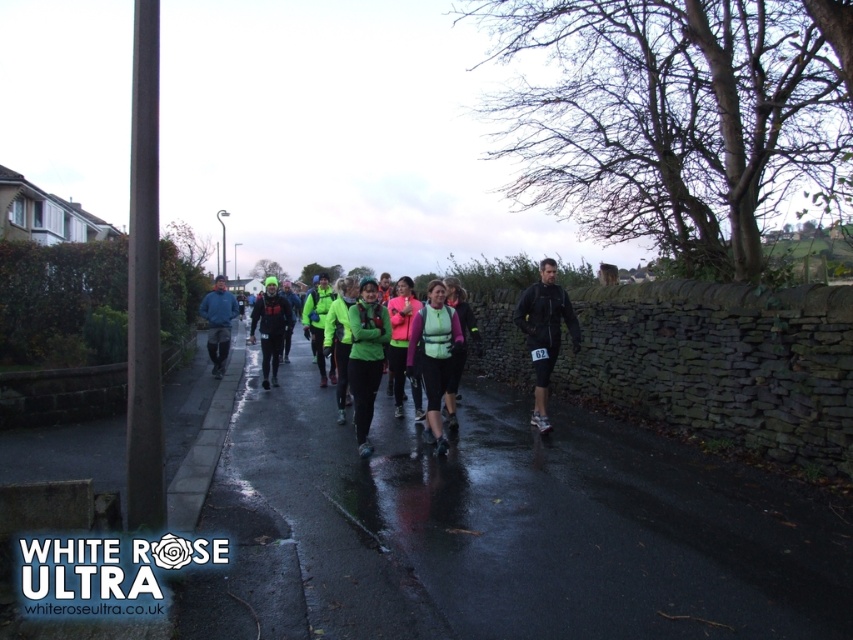
Looking at this image, you are a race official at the White Rose Ultra. You need to determine if the green matte vest at center and the black matte running suit at center are close enough to be considered in the same group for the race standings. The rule states that runners must be within 5 meters of each other to qualify. Can you confirm if they meet this requirement?

The distance between the green matte vest at center and the black matte running suit at center is 5.82 meters, which exceeds the 5 meters requirement. Therefore, they do not qualify as being in the same group.

From the picture: You are a photographer wanting to capture both the green matte jacket at center and the matte blue jacket at center in a single frame. Since the road is wet and reflective, you need to ensure that the jackets are positioned such that their widths do not overlap in the reflection. Given their sizes, which jacket should you place closer to the camera to avoid overlapping reflections?

The green matte jacket at center has a smaller width than the matte blue jacket at center. To prevent overlapping reflections, position the narrower green matte jacket at center closer to the camera so its reflection takes up less space, allowing both reflections to remain distinct.

You are a photographer positioned at the starting line of the White Rose Ultra race. You want to capture a photo of the green matte jacket at center and the matte blue jacket at center. Which runner should you focus on first to ensure both are in the frame?

The green matte jacket at center is in front of the matte blue jacket at center, so you should focus on the green matte jacket at center first to ensure both are in the frame.